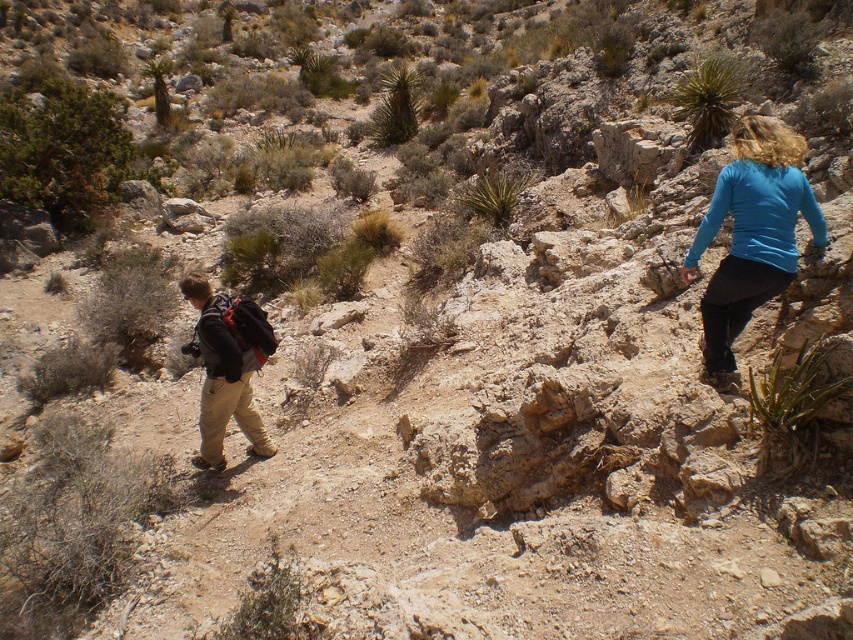
Is green shrub at upper left thinner than matte black backpack at left?

No, green shrub at upper left is not thinner than matte black backpack at left.

Is green shrub at upper left above matte black backpack at left?

Yes, green shrub at upper left is above matte black backpack at left.

Describe the element at coordinates (62, 148) in the screenshot. I see `green shrub at upper left` at that location.

Where is `green shrub at upper left`? The width and height of the screenshot is (853, 640). green shrub at upper left is located at coordinates (62, 148).

Which is behind, point (735, 141) or point (387, 76)?

Positioned behind is point (387, 76).

Where is `blue matte shirt at upper right`? This screenshot has width=853, height=640. blue matte shirt at upper right is located at coordinates (751, 236).

Between point (741, 298) and point (375, 106), which one is positioned behind?

The point (375, 106) is behind.

Locate an element on the screen. blue matte shirt at upper right is located at coordinates (751, 236).

Which is behind, point (312, 627) or point (683, 76)?

The point (683, 76) is more distant.

Identify the location of green leafy bush at lower center. tap(271, 604).